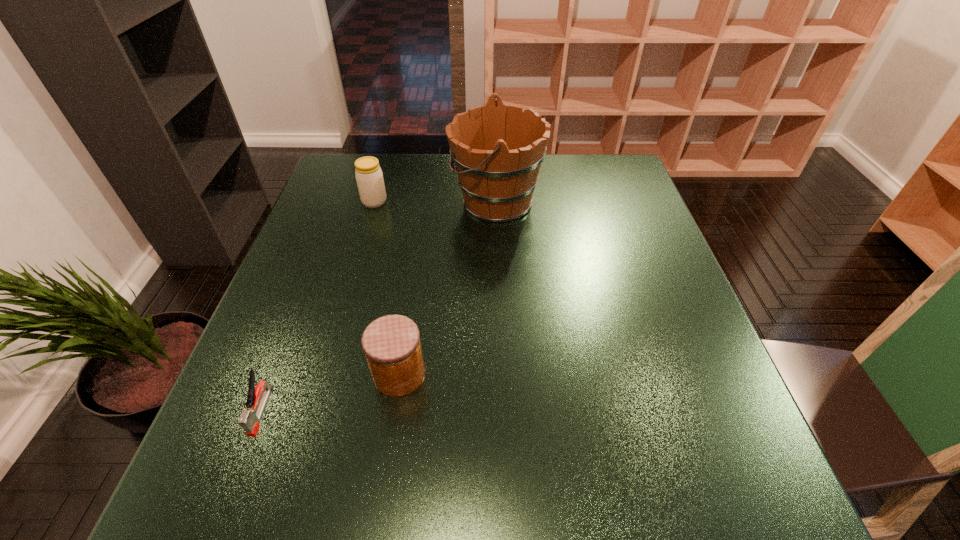
In the image, there is a desktop. Where is `free space at the near edge`? This screenshot has height=540, width=960. free space at the near edge is located at coordinates (309, 490).

At what (x,y) coordinates should I click in order to perform the action: click on vacant area at the left edge. Please return your answer as a coordinate pair (x, y). Image resolution: width=960 pixels, height=540 pixels. Looking at the image, I should click on (327, 296).

Locate an element on the screen. The image size is (960, 540). vacant space at the right edge is located at coordinates (675, 272).

Locate an element on the screen. The width and height of the screenshot is (960, 540). free space at the far left corner of the desktop is located at coordinates (350, 184).

In the image, there is a desktop. Where is `vacant space at the far right corner`? This screenshot has width=960, height=540. vacant space at the far right corner is located at coordinates (604, 161).

Locate an element on the screen. The width and height of the screenshot is (960, 540). free space between the right jar and the second object from left to right is located at coordinates (387, 288).

Locate an element on the screen. Image resolution: width=960 pixels, height=540 pixels. vacant area that lies between the nearer jar and the farther jar is located at coordinates (387, 288).

Find the location of `free space between the rightmost object and the right jar`. free space between the rightmost object and the right jar is located at coordinates (447, 288).

At what (x,y) coordinates should I click in order to perform the action: click on vacant space that's between the nearer jar and the leftmost object. Please return your answer as a coordinate pair (x, y). Looking at the image, I should click on (330, 393).

This screenshot has height=540, width=960. Identify the location of vacant region between the stapler and the wine bucket. (379, 306).